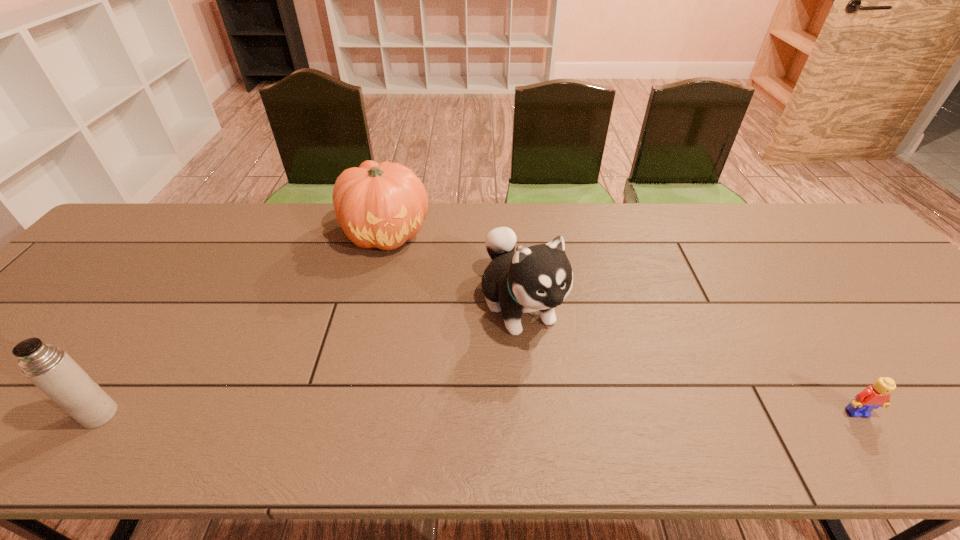
I want to click on vacant space on the desktop that is between the thermos bottle and the Lego and is positioned on the carved face of the farthest object, so click(480, 413).

Find the location of `free space on the desktop that is between the thermos bottle and the rightmost object and is positioned at the face of the third nearest object`. free space on the desktop that is between the thermos bottle and the rightmost object and is positioned at the face of the third nearest object is located at coordinates (586, 413).